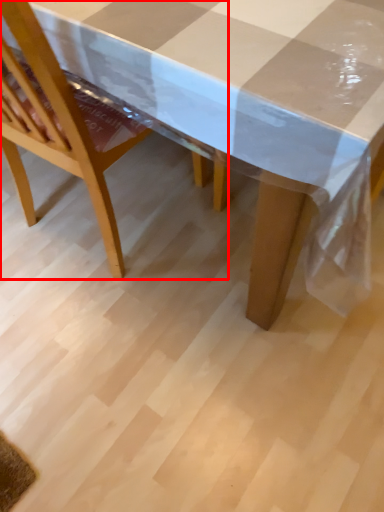
Question: From the image, what is the correct spatial relationship of chair (annotated by the red box) in relation to picnic table?

Choices:
 (A) left
 (B) right

Answer: (A)